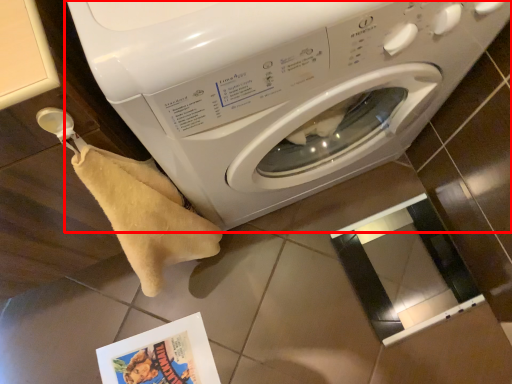
Question: In this image, where is washing machine (annotated by the red box) located relative to comic book?

Choices:
 (A) right
 (B) left

Answer: (A)